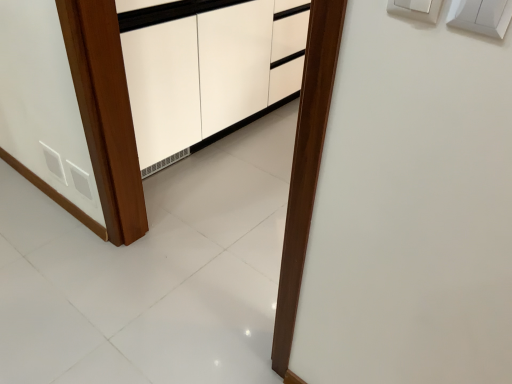
Question: From the image's perspective, is white plastic light switch at upper right below white plastic switch at upper right?

Choices:
 (A) no
 (B) yes

Answer: (B)

Question: Is white plastic light switch at upper right behind white plastic switch at upper right?

Choices:
 (A) no
 (B) yes

Answer: (A)

Question: Is white plastic light switch at upper right surrounding white plastic switch at upper right?

Choices:
 (A) yes
 (B) no

Answer: (B)

Question: From a real-world perspective, is white plastic light switch at upper right located beneath white plastic switch at upper right?

Choices:
 (A) yes
 (B) no

Answer: (A)

Question: Is white plastic light switch at upper right positioned in front of white plastic switch at upper right?

Choices:
 (A) no
 (B) yes

Answer: (B)

Question: Does white plastic light switch at upper right have a greater width compared to white plastic switch at upper right?

Choices:
 (A) no
 (B) yes

Answer: (B)

Question: Is white plastic switch at upper right smaller than white plastic light switch at upper right?

Choices:
 (A) yes
 (B) no

Answer: (B)

Question: From the image's perspective, would you say white plastic switch at upper right is shown under white plastic light switch at upper right?

Choices:
 (A) yes
 (B) no

Answer: (B)

Question: Can you confirm if white plastic switch at upper right is wider than white plastic light switch at upper right?

Choices:
 (A) no
 (B) yes

Answer: (A)

Question: Is the depth of white plastic switch at upper right less than that of white plastic light switch at upper right?

Choices:
 (A) no
 (B) yes

Answer: (A)

Question: From the image's perspective, does white plastic switch at upper right appear higher than white plastic light switch at upper right?

Choices:
 (A) no
 (B) yes

Answer: (B)

Question: Is white plastic switch at upper right surrounding white plastic light switch at upper right?

Choices:
 (A) yes
 (B) no

Answer: (B)

Question: In the image, is white plastic light switch at upper right on the left side or the right side of white plastic switch at upper right?

Choices:
 (A) right
 (B) left

Answer: (A)